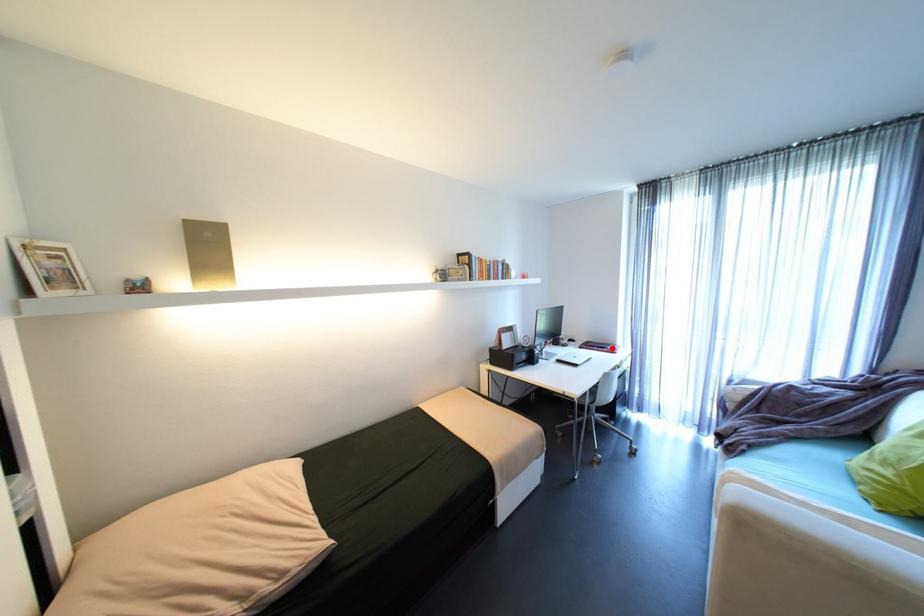
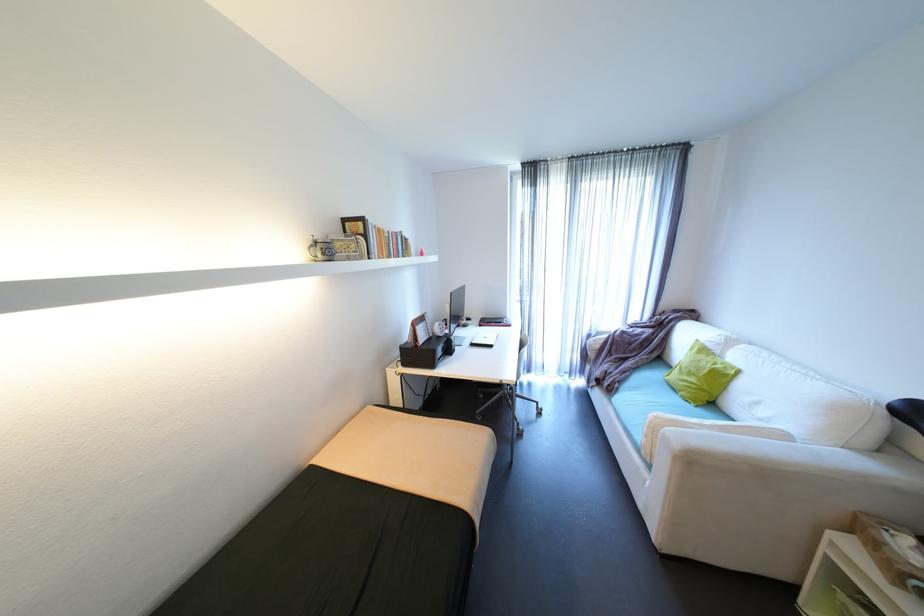
Locate, in the second image, the point that corresponds to the highlighted location in the first image.

(508, 323)